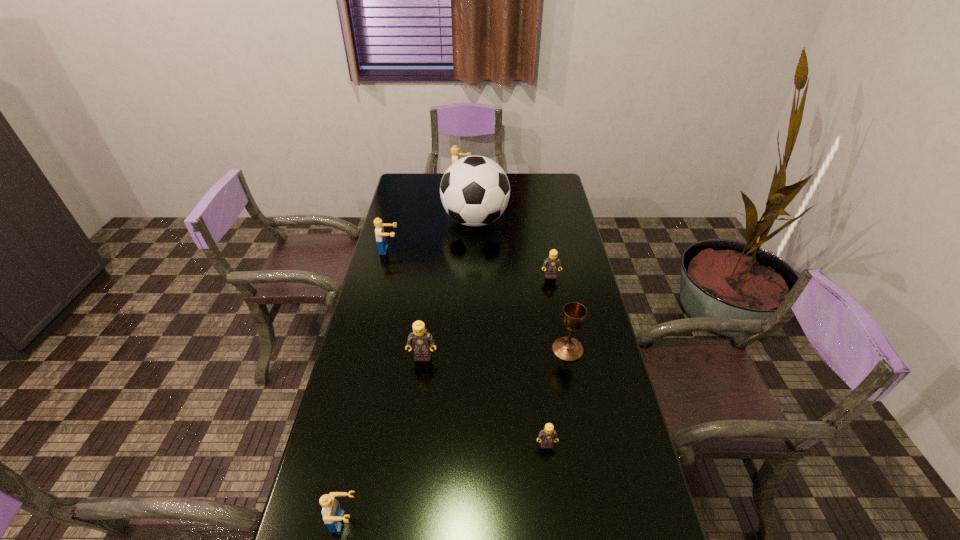
Identify which blue Lego is the second closest to the soccer ball. Please provide its 2D coordinates. Your answer should be formatted as a tuple, i.e. [(x, y)], where the tuple contains the x and y coordinates of a point satisfying the conditions above.

[(455, 153)]

Find the location of a particular element. This screenshot has width=960, height=540. blue Lego that is the second nearest to the chalice is located at coordinates (379, 230).

Identify the location of tan Lego identified as the third closest to the second farthest object. The width and height of the screenshot is (960, 540). (547, 436).

Identify the location of the closest tan Lego to the second farthest blue Lego. (420, 339).

This screenshot has width=960, height=540. Find the location of `free location that satisfies the following two spatial constraints: 1. on the face of the chalice; 2. on the left side of the biggest blue Lego`. free location that satisfies the following two spatial constraints: 1. on the face of the chalice; 2. on the left side of the biggest blue Lego is located at coordinates tap(451, 349).